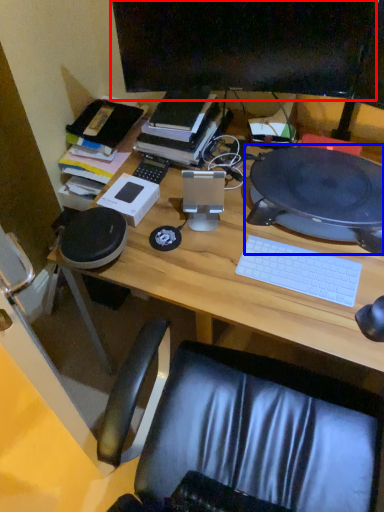
Question: Which object is further to the camera taking this photo, computer monitor (highlighted by a red box) or computer (highlighted by a blue box)?

Choices:
 (A) computer monitor
 (B) computer

Answer: (A)